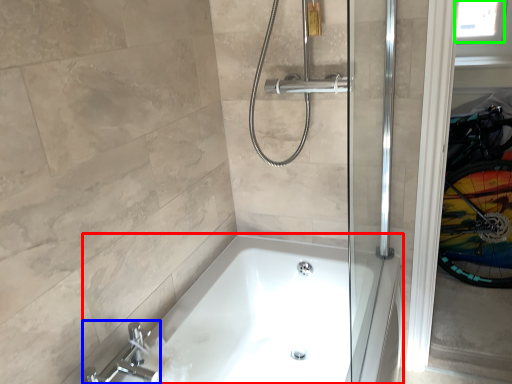
Question: Considering the real-world distances, which object is closest to bathtub (highlighted by a red box)? tap (highlighted by a blue box) or window screen (highlighted by a green box).

Choices:
 (A) tap
 (B) window screen

Answer: (A)